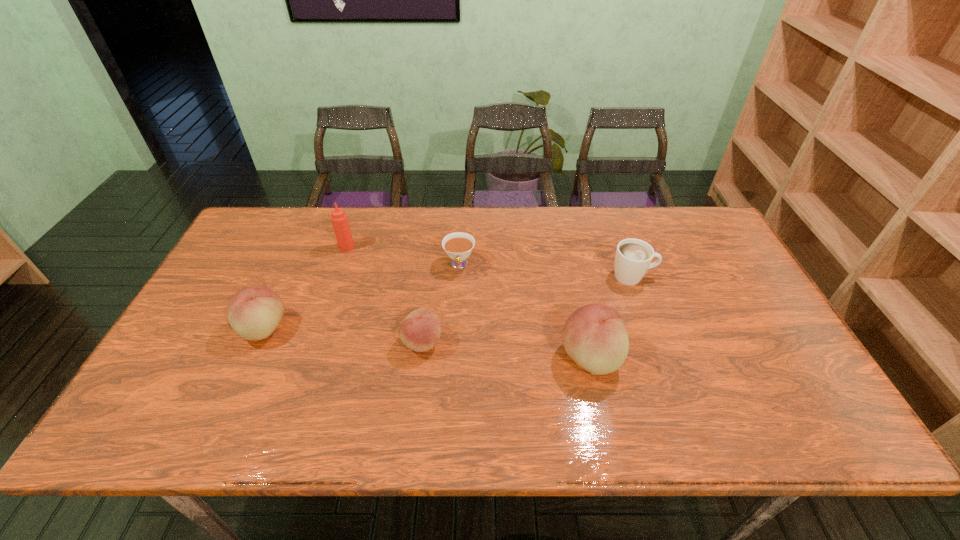
At what (x,y) coordinates should I click in order to perform the action: click on the leftmost object. Please return your answer as a coordinate pair (x, y). Image resolution: width=960 pixels, height=540 pixels. Looking at the image, I should click on (254, 313).

The height and width of the screenshot is (540, 960). Find the location of `the second tallest peach`. the second tallest peach is located at coordinates (254, 313).

I want to click on the second peach from left to right, so [x=420, y=331].

Find the location of a particular element. the rightmost peach is located at coordinates (594, 336).

Find the location of a particular element. the fifth shortest object is located at coordinates (594, 336).

At what (x,y) coordinates should I click in order to perform the action: click on the farthest object. Please return your answer as a coordinate pair (x, y). Looking at the image, I should click on (339, 218).

Image resolution: width=960 pixels, height=540 pixels. What are the coordinates of `the fifth object from right to left` in the screenshot? It's located at (339, 218).

At what (x,y) coordinates should I click in order to perform the action: click on cappuccino. Please return your answer as a coordinate pair (x, y). The height and width of the screenshot is (540, 960). Looking at the image, I should click on (633, 257).

Where is `teacup`? teacup is located at coordinates (458, 246).

Locate an element on the screen. This screenshot has width=960, height=540. vacant space positioned on the back of the second tallest peach is located at coordinates (292, 265).